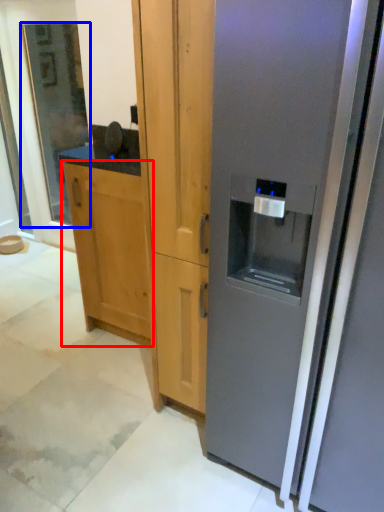
Question: Among these objects, which one is farthest to the camera, cabinetry (highlighted by a red box) or glass door (highlighted by a blue box)?

Choices:
 (A) cabinetry
 (B) glass door

Answer: (B)